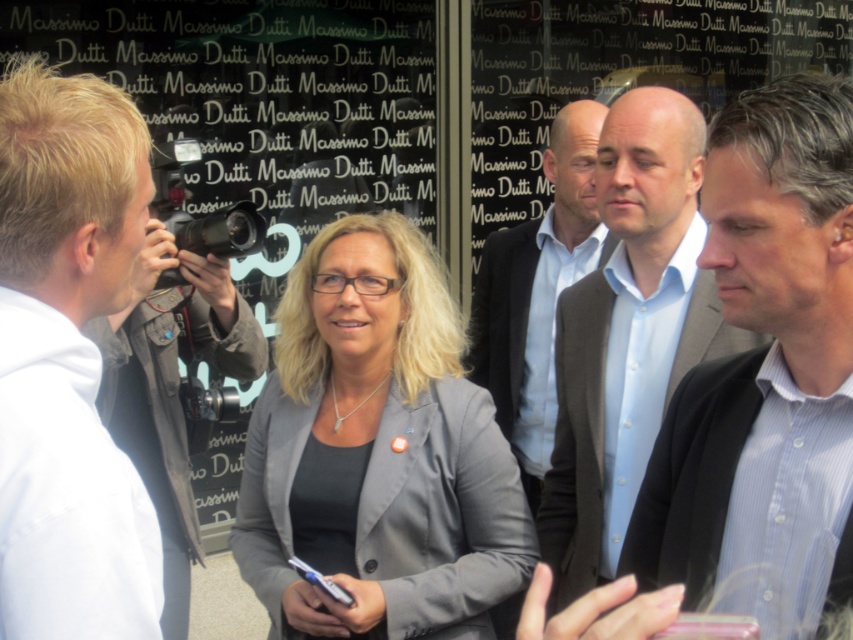
You are standing at the origin point in the image. Which of the two points, point (149, 472) or point (543, 225), is closer to you?

Point (149, 472) is in front of point (543, 225), so it is closer to you.

What is located at the point marked by the coordinates (376, 451) in the image?

The point marked by the coordinates (376, 451) is located at the gray fabric jacket at center.